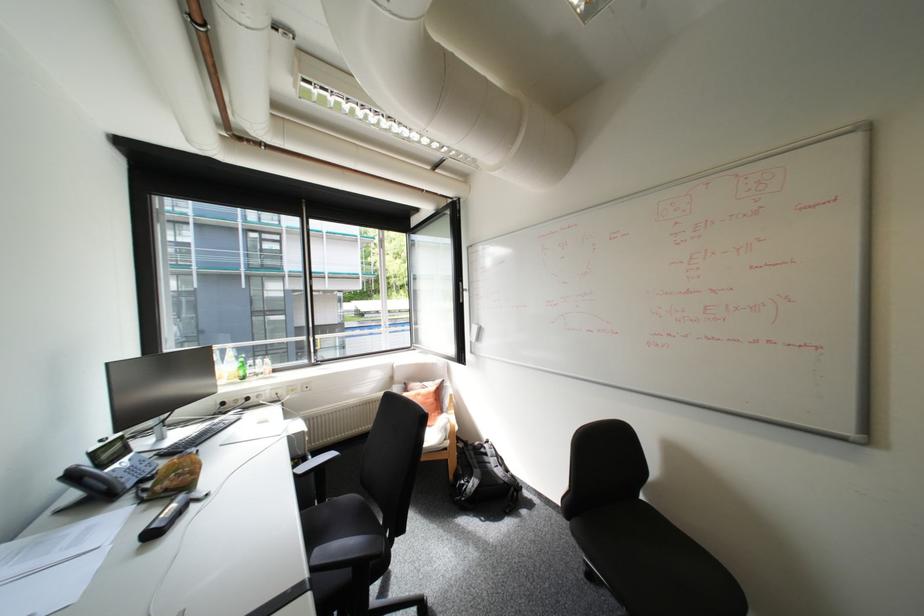
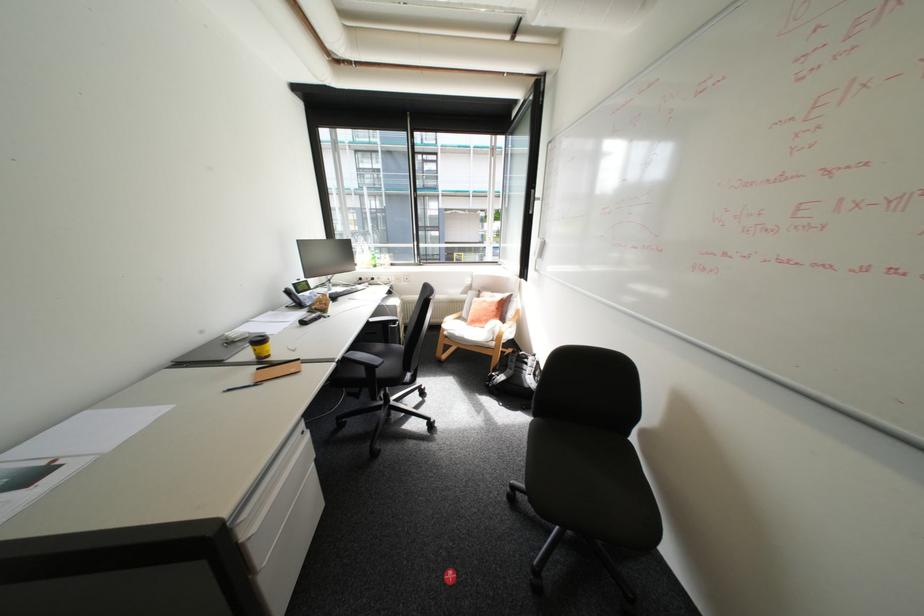
The first image is from the beginning of the video and the second image is from the end. How did the camera likely rotate when shooting the video?

The rotation direction of the camera is left-down.